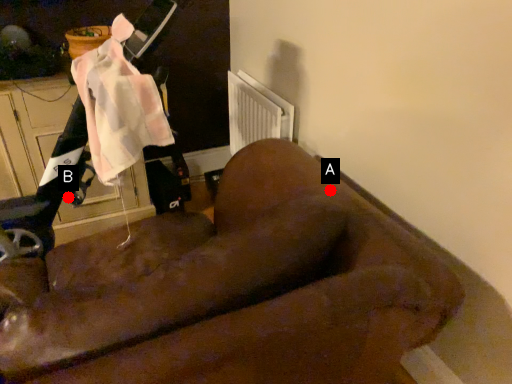
Question: Two points are circled on the image, labeled by A and B beside each circle. Which point is closer to the camera?

Choices:
 (A) A is closer
 (B) B is closer

Answer: (A)